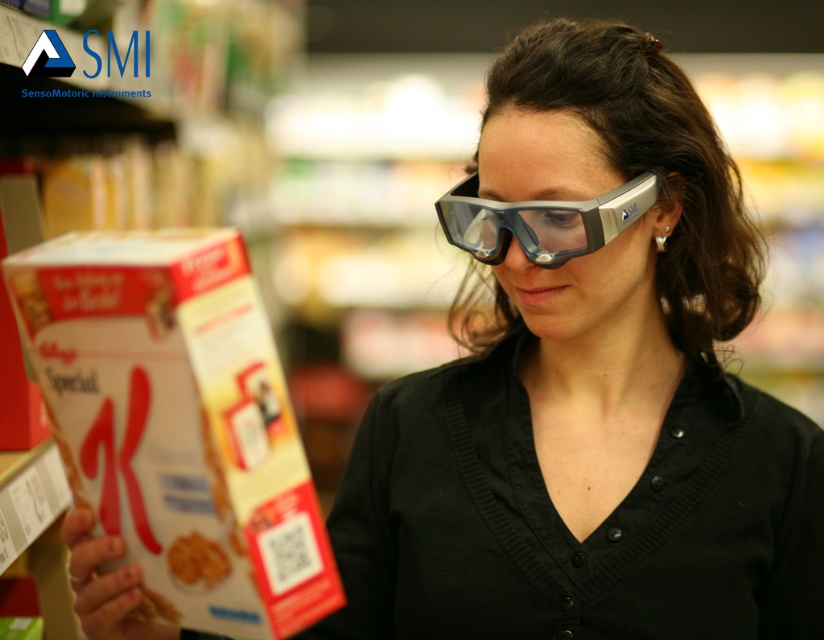
You are a researcher analyzing eye movements in a grocery store. You observe the transparent plastic goggles at center and the golden crispy cereal at lower left in the image. Which object is positioned higher in the visual field of the person wearing the goggles?

The transparent plastic goggles at center is taller than the golden crispy cereal at lower left, so the transparent plastic goggles at center is positioned higher in the visual field of the person wearing the goggles.

What is located at the point with coordinates (176, 419) in the image?

The point with coordinates (176, 419) indicates the white cardboard box at lower left.

Consider the image. You are trying to determine if the white cardboard box at lower left can fit through a narrow doorway that is only as wide as the transparent plastic goggles at center. Based on their widths, can the box pass through the doorway?

The white cardboard box at lower left might be wider than transparent plastic goggles at center, so there is a possibility that it cannot fit through the doorway if the box is indeed wider.